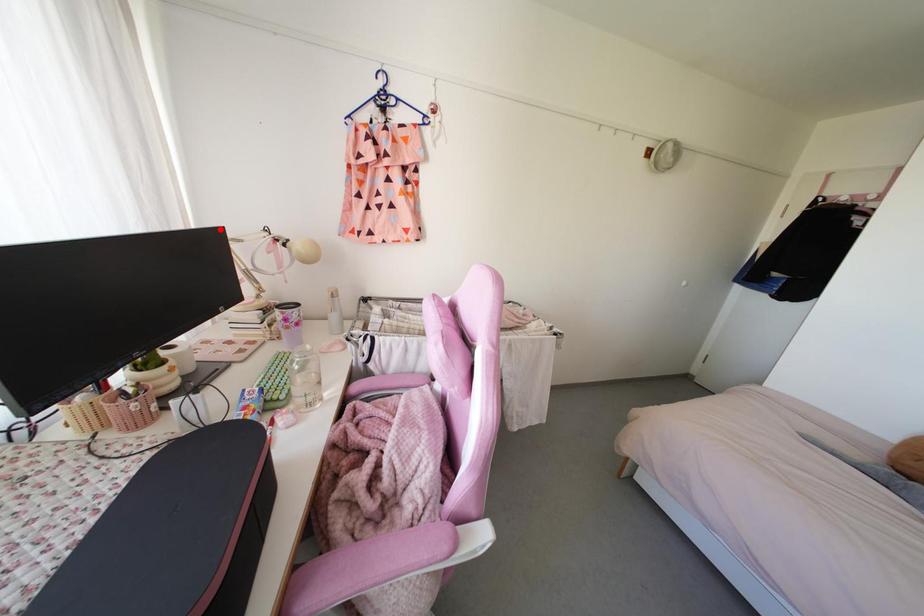
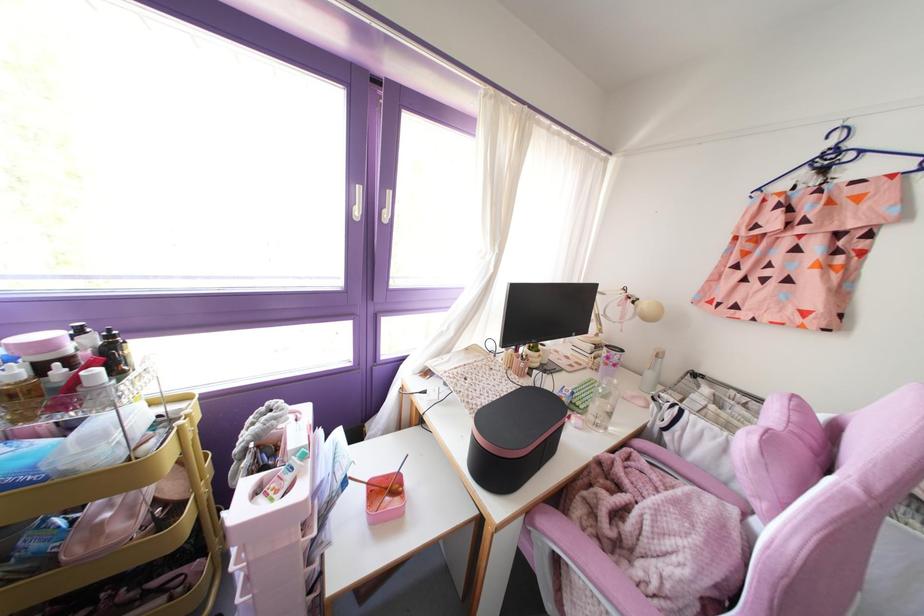
Where in the second image is the point corresponding to the highlighted location from the first image?

(594, 285)